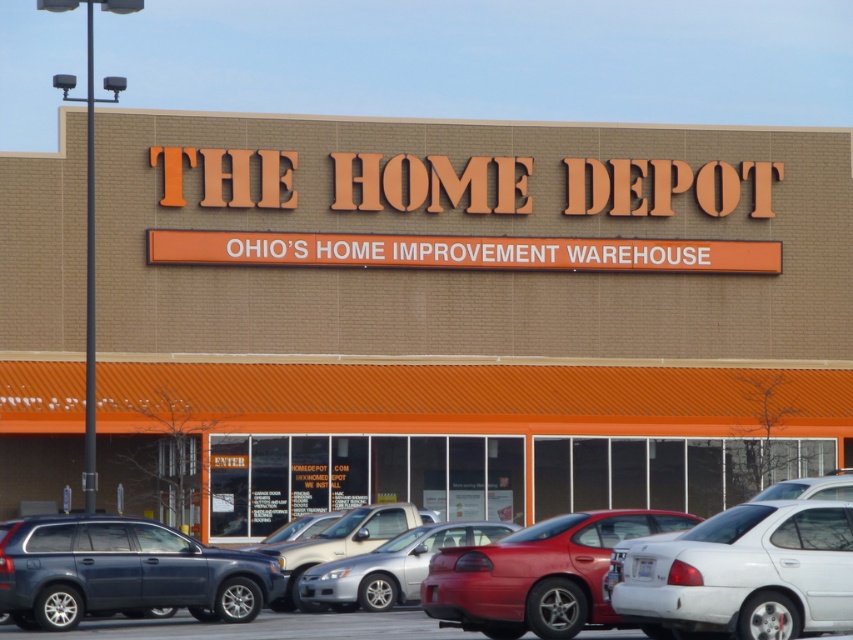
Who is lower down, white glossy sedan at lower right or metallic silver sedan at center?

metallic silver sedan at center is lower down.

What do you see at coordinates (743, 573) in the screenshot? I see `white glossy sedan at lower right` at bounding box center [743, 573].

The height and width of the screenshot is (640, 853). Describe the element at coordinates (743, 573) in the screenshot. I see `white glossy sedan at lower right` at that location.

You are a GUI agent. You are given a task and a screenshot of the screen. Output one action in this format:
    pyautogui.click(x=<x>, y=<y>)
    Task: Click on the white glossy sedan at lower right
    The height and width of the screenshot is (640, 853).
    Given the screenshot: What is the action you would take?
    pyautogui.click(x=743, y=573)

Is brown brick building at center below silver metallic truck at center?

No, brown brick building at center is not below silver metallic truck at center.

Can you confirm if brown brick building at center is smaller than silver metallic truck at center?

Actually, brown brick building at center might be larger than silver metallic truck at center.

This screenshot has width=853, height=640. In order to click on brown brick building at center in this screenshot , I will do `click(467, 314)`.

Who is positioned more to the right, matte black suv at center or metallic silver sedan at center?

From the viewer's perspective, metallic silver sedan at center appears more on the right side.

Is matte black suv at center further to camera compared to metallic silver sedan at center?

No.

Who is more forward, (61, 573) or (476, 538)?

Point (61, 573) is more forward.

Locate an element on the screen. This screenshot has height=640, width=853. matte black suv at center is located at coordinates (123, 572).